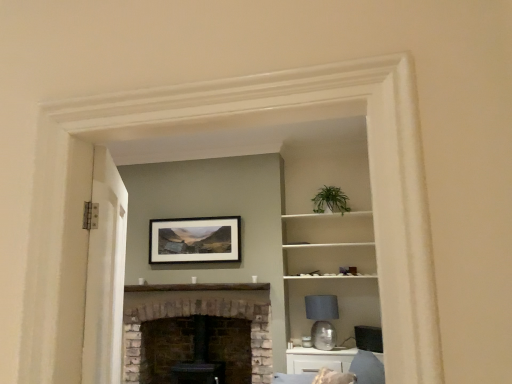
Question: Are matte gray glass lampshade at center-right and white glossy cabinet at lower right located far from each other?

Choices:
 (A) no
 (B) yes

Answer: (A)

Question: Is matte gray glass lampshade at center-right looking in the opposite direction of white glossy cabinet at lower right?

Choices:
 (A) no
 (B) yes

Answer: (A)

Question: Does matte gray glass lampshade at center-right come in front of white glossy cabinet at lower right?

Choices:
 (A) no
 (B) yes

Answer: (A)

Question: From the image's perspective, does matte gray glass lampshade at center-right appear lower than white glossy cabinet at lower right?

Choices:
 (A) no
 (B) yes

Answer: (A)

Question: Could you tell me if matte gray glass lampshade at center-right is turned towards white glossy cabinet at lower right?

Choices:
 (A) no
 (B) yes

Answer: (B)

Question: From the image's perspective, is matte black picture frame at center located above or below white painted wood door at left?

Choices:
 (A) below
 (B) above

Answer: (A)

Question: Is matte black picture frame at center in front of or behind white painted wood door at left in the image?

Choices:
 (A) behind
 (B) front

Answer: (A)

Question: Is matte black picture frame at center bigger or smaller than white painted wood door at left?

Choices:
 (A) small
 (B) big

Answer: (A)

Question: Is matte black picture frame at center wider or thinner than white painted wood door at left?

Choices:
 (A) wide
 (B) thin

Answer: (B)

Question: Does point (331, 342) appear closer or farther from the camera than point (264, 379)?

Choices:
 (A) closer
 (B) farther

Answer: (A)

Question: In terms of width, does matte gray glass lampshade at center-right look wider or thinner when compared to white stone fireplace at center?

Choices:
 (A) thin
 (B) wide

Answer: (A)

Question: Considering their positions, is matte gray glass lampshade at center-right located in front of or behind white stone fireplace at center?

Choices:
 (A) behind
 (B) front

Answer: (A)

Question: In the image, is matte gray glass lampshade at center-right on the left side or the right side of white stone fireplace at center?

Choices:
 (A) left
 (B) right

Answer: (B)

Question: Based on their positions, is white painted wood door at left located to the left or right of matte gray glass lampshade at center-right?

Choices:
 (A) left
 (B) right

Answer: (A)

Question: Which is correct: white painted wood door at left is inside matte gray glass lampshade at center-right, or outside of it?

Choices:
 (A) inside
 (B) outside

Answer: (B)